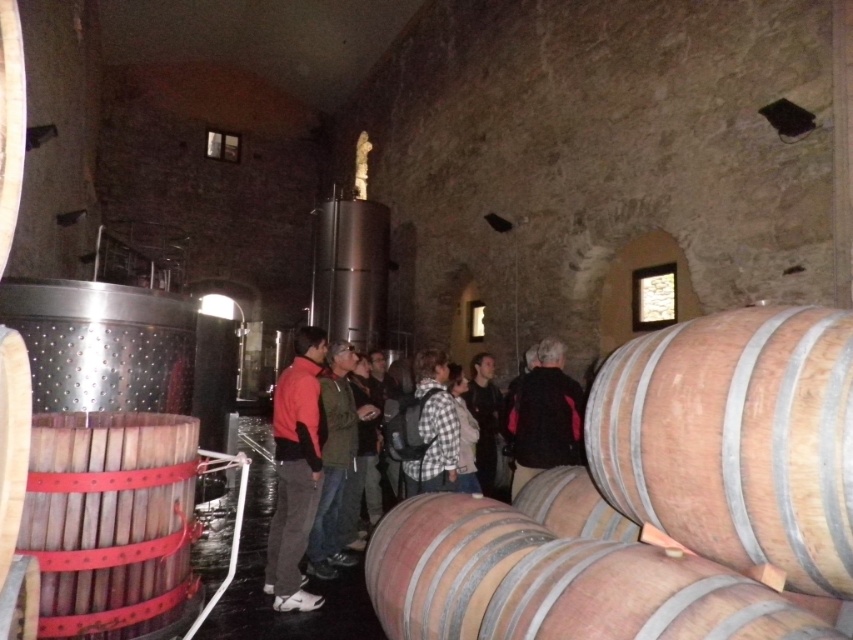
Question: Is natural wood barrel at right thinner than black leather jacket at center?

Choices:
 (A) yes
 (B) no

Answer: (B)

Question: Is natural wood barrel at lower right thinner than green fabric jacket at center?

Choices:
 (A) no
 (B) yes

Answer: (A)

Question: Is checkered fabric shirt at center bigger than dark gray sweater at center?

Choices:
 (A) yes
 (B) no

Answer: (B)

Question: Which of the following is the farthest from the observer?

Choices:
 (A) red fleece jacket at center
 (B) natural wood barrel at lower right

Answer: (A)

Question: Which of the following is the closest to the observer?

Choices:
 (A) red fleece jacket at center
 (B) wooden barrel with red band at lower left

Answer: (B)

Question: Estimate the real-world distances between objects in this image. Which object is closer to the dark gray sweater at center?

Choices:
 (A) red fleece jacket at center
 (B) checkered fabric shirt at center

Answer: (B)